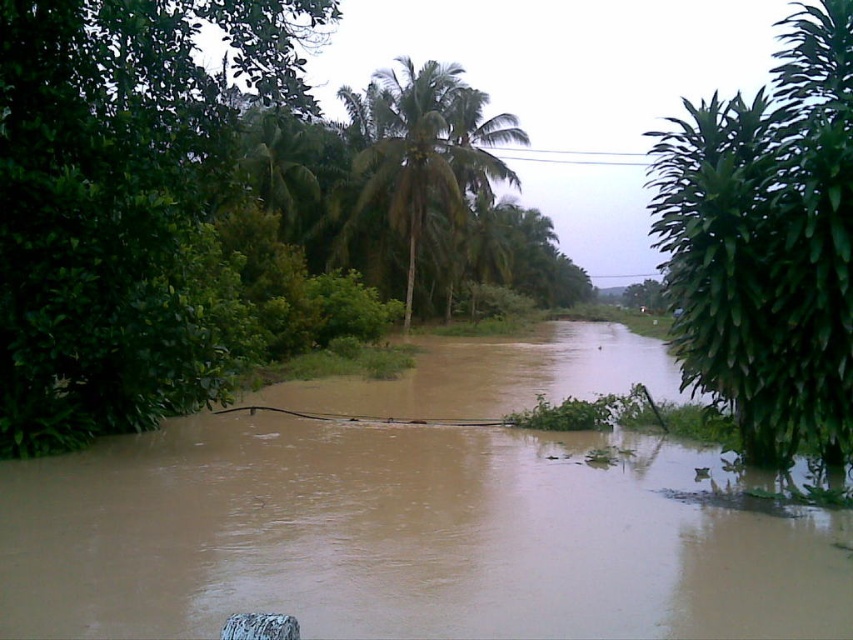
You are a hiker trying to cross the flooded area shown in the image. You see the brown muddy water at center and the green leafy palm tree at center. Which of these two objects takes up more space in the image?

The green leafy palm tree at center occupies more space than the brown muddy water at center in the image.

You are standing at the origin point in the flooded area. Which direction should you move to reach the green leafy tree at left?

The green leafy tree at left is located at coordinates point (117, 200), so you should move towards the left and slightly forward to reach it.